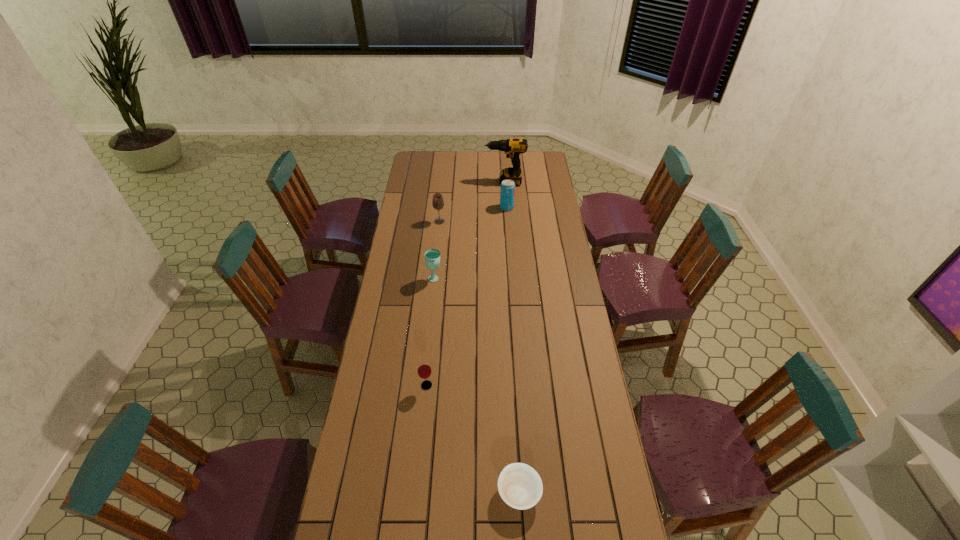
Locate an element on the screen. This screenshot has height=540, width=960. the tallest object is located at coordinates (513, 147).

Where is `drill`? drill is located at coordinates (513, 147).

The width and height of the screenshot is (960, 540). What are the coordinates of `the third farthest object` in the screenshot? It's located at (437, 202).

Find the location of a particular element. Image resolution: width=960 pixels, height=540 pixels. soda can is located at coordinates (507, 192).

At what (x,y) coordinates should I click in order to perform the action: click on the fourth farthest object. Please return your answer as a coordinate pair (x, y). The height and width of the screenshot is (540, 960). Looking at the image, I should click on pyautogui.click(x=432, y=256).

Where is `the nearest glass`? Image resolution: width=960 pixels, height=540 pixels. the nearest glass is located at coordinates (424, 370).

The width and height of the screenshot is (960, 540). I want to click on the second nearest object, so click(x=424, y=370).

I want to click on the shortest object, so click(519, 485).

This screenshot has width=960, height=540. Find the location of `the nearest object`. the nearest object is located at coordinates (519, 485).

Where is `free space located 0.190m at the tip of the tallest object`? free space located 0.190m at the tip of the tallest object is located at coordinates (451, 183).